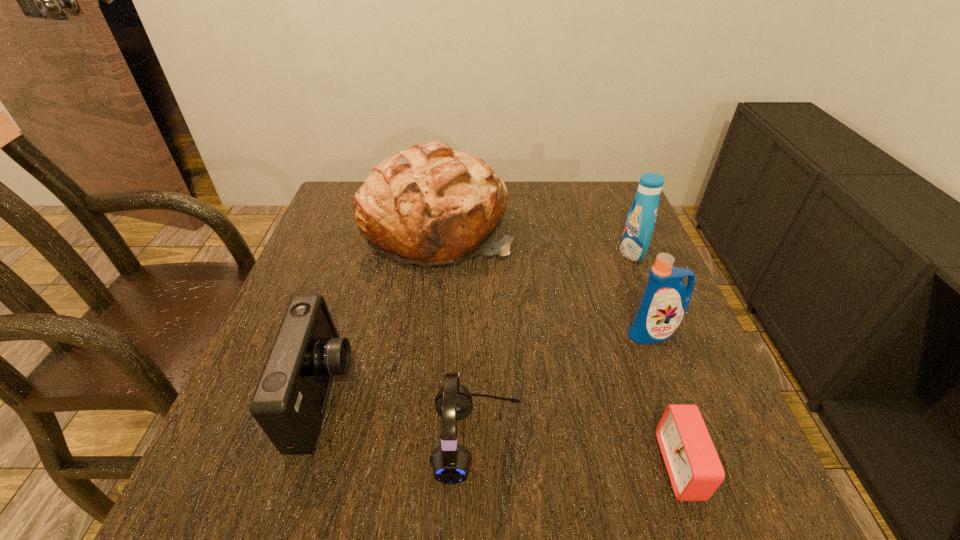
At what (x,y) coordinates should I click in order to perform the action: click on unoccupied area between the bread and the headset. Please return your answer as a coordinate pair (x, y). The width and height of the screenshot is (960, 540). Looking at the image, I should click on (457, 334).

Identify which object is the second nearest to the headset. Please provide its 2D coordinates. Your answer should be formatted as a tuple, i.e. [(x, y)], where the tuple contains the x and y coordinates of a point satisfying the conditions above.

[(695, 471)]

Locate which object ranks in proximity to the farther detergent. Please provide its 2D coordinates. Your answer should be formatted as a tuple, i.e. [(x, y)], where the tuple contains the x and y coordinates of a point satisfying the conditions above.

[(665, 301)]

You are a GUI agent. You are given a task and a screenshot of the screen. Output one action in this format:
    pyautogui.click(x=<x>, y=<y>)
    Task: Click on the vacant area in the image that satisfies the following two spatial constraints: 1. on the label of the fourth nearest object; 2. on the front-facing side of the alarm clock
    The width and height of the screenshot is (960, 540).
    Given the screenshot: What is the action you would take?
    pyautogui.click(x=704, y=466)

Identify the location of blank area in the image that satisfies the following two spatial constraints: 1. on the label of the nearer detergent; 2. on the front-facing side of the camera. (677, 397).

Find the location of a particular element. free location that satisfies the following two spatial constraints: 1. on the front-facing side of the farther detergent; 2. on the label of the third farthest object is located at coordinates pyautogui.click(x=665, y=333).